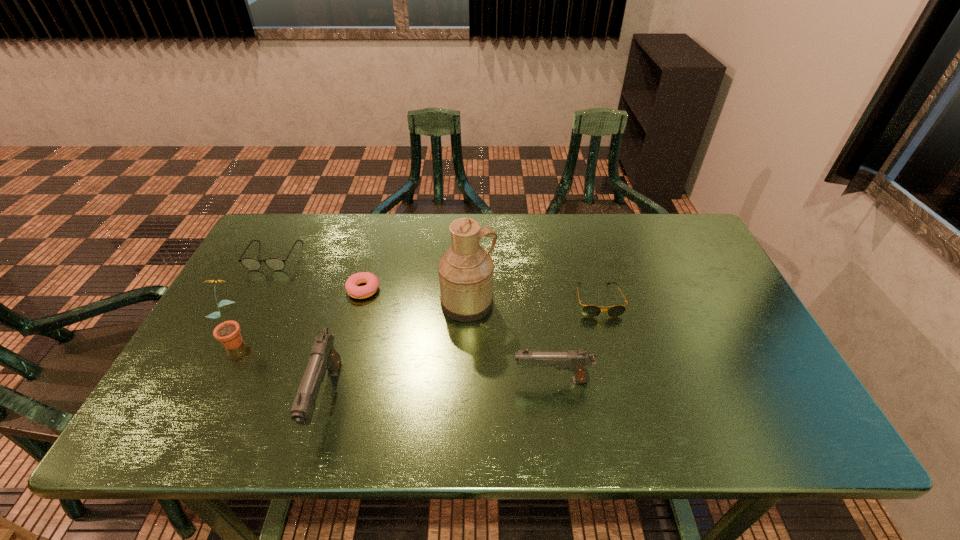
Image resolution: width=960 pixels, height=540 pixels. Identify the location of the third object from right to left. (466, 272).

Identify the location of free space located in the direction the right gun is aimed. The image size is (960, 540). (469, 380).

Locate an element on the screen. vacant point located in the direction the right gun is aimed is located at coordinates (396, 380).

Identify the location of vacant space located 0.390m in the direction the right gun is aimed. (345, 380).

This screenshot has width=960, height=540. What are the coordinates of `vacant region located on the back of the shortest object` in the screenshot? It's located at (384, 215).

This screenshot has width=960, height=540. What are the coordinates of `free space located 0.240m on the front-facing side of the sunglasses` in the screenshot? It's located at (624, 399).

I want to click on vacant space located on the flower of the sixth shortest object, so click(206, 395).

I want to click on vacant space positioned 0.220m on the front-facing side of the spectacles, so click(236, 328).

Image resolution: width=960 pixels, height=540 pixels. I want to click on vacant space located 0.320m on the right of the tallest object, so click(612, 303).

Where is `object situated at the far edge`? The width and height of the screenshot is (960, 540). object situated at the far edge is located at coordinates (252, 264).